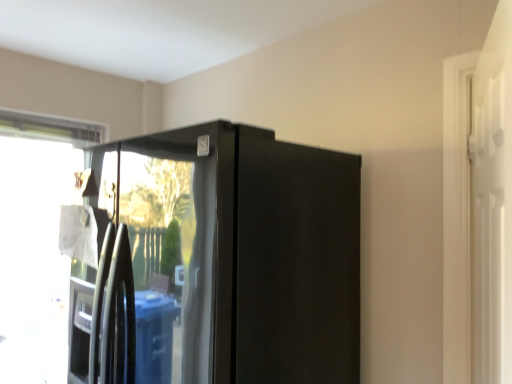
Question: Is glossy black refrigerator at center oriented towards white glossy screen door at right?

Choices:
 (A) yes
 (B) no

Answer: (B)

Question: Is glossy black refrigerator at center further to camera compared to white glossy screen door at right?

Choices:
 (A) yes
 (B) no

Answer: (A)

Question: Is glossy black refrigerator at center located outside white glossy screen door at right?

Choices:
 (A) yes
 (B) no

Answer: (A)

Question: Does glossy black refrigerator at center have a lesser width compared to white glossy screen door at right?

Choices:
 (A) no
 (B) yes

Answer: (A)

Question: From a real-world perspective, is glossy black refrigerator at center positioned over white glossy screen door at right based on gravity?

Choices:
 (A) no
 (B) yes

Answer: (A)

Question: Choose the correct answer: Is white glossy screen door at right inside transparent glass window at left or outside it?

Choices:
 (A) outside
 (B) inside

Answer: (A)

Question: Is white glossy screen door at right to the left or to the right of transparent glass window at left in the image?

Choices:
 (A) left
 (B) right

Answer: (B)

Question: Looking at the image, does white glossy screen door at right seem bigger or smaller compared to transparent glass window at left?

Choices:
 (A) big
 (B) small

Answer: (B)

Question: In terms of width, does white glossy screen door at right look wider or thinner when compared to transparent glass window at left?

Choices:
 (A) thin
 (B) wide

Answer: (A)

Question: From a real-world perspective, is glossy black refrigerator at center positioned above or below white glossy screen door at right?

Choices:
 (A) above
 (B) below

Answer: (B)

Question: Is point (102, 357) closer or farther from the camera than point (501, 183)?

Choices:
 (A) farther
 (B) closer

Answer: (A)

Question: Is glossy black refrigerator at center bigger or smaller than white glossy screen door at right?

Choices:
 (A) small
 (B) big

Answer: (B)

Question: Is glossy black refrigerator at center spatially inside white glossy screen door at right, or outside of it?

Choices:
 (A) inside
 (B) outside

Answer: (B)

Question: Is point (58, 278) closer or farther from the camera than point (353, 264)?

Choices:
 (A) farther
 (B) closer

Answer: (A)

Question: Is transparent glass window at left spatially inside glossy black refrigerator at center, or outside of it?

Choices:
 (A) outside
 (B) inside

Answer: (A)